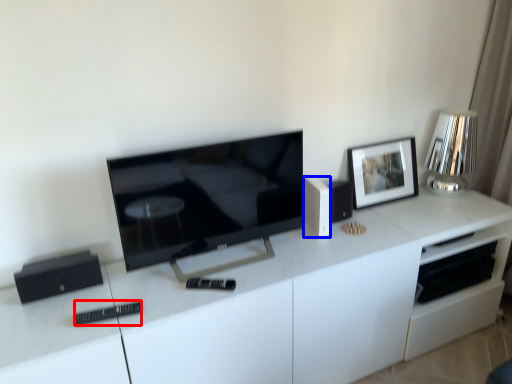
Question: Which of the following is the closest to the observer, remote (highlighted by a red box) or speaker (highlighted by a blue box)?

Choices:
 (A) remote
 (B) speaker

Answer: (A)